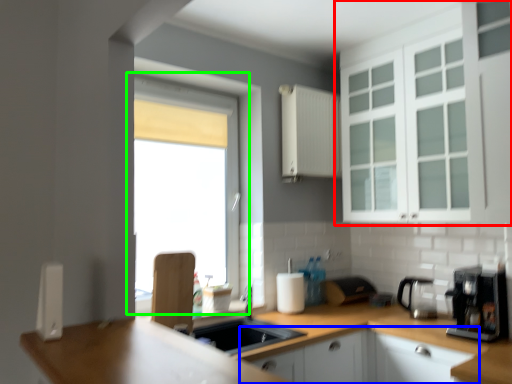
Question: Estimate the real-world distances between objects in this image. Which object is closer to cabinetry (highlighted by a red box), cabinetry (highlighted by a blue box) or window (highlighted by a green box)?

Choices:
 (A) cabinetry
 (B) window

Answer: (A)